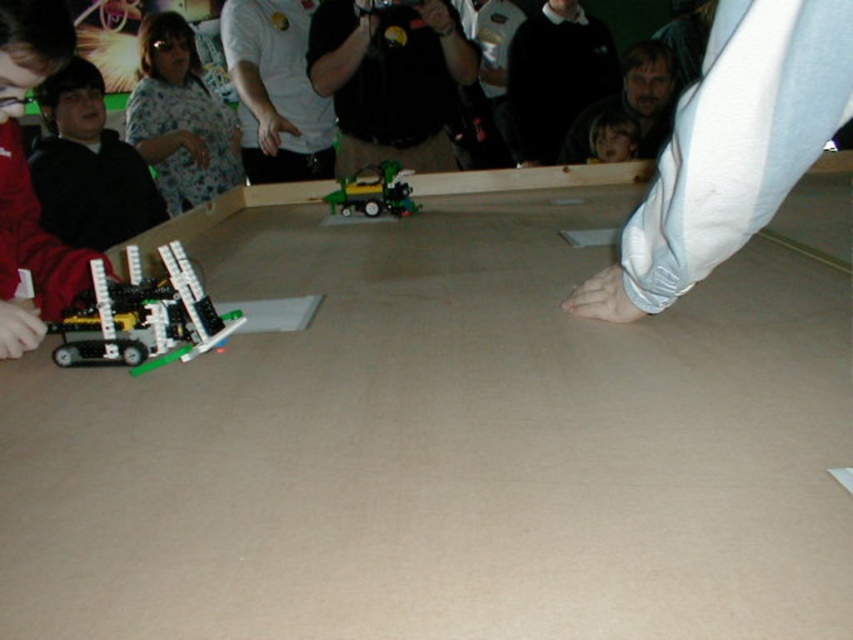
Question: Which object appears closest to the camera in this image?

Choices:
 (A) white matte shirt at upper center
 (B) translucent plastic robot at lower left

Answer: (B)

Question: Which of the following is the closest to the observer?

Choices:
 (A) (74, 273)
 (B) (357, 16)
 (C) (160, 154)
 (D) (590, 285)

Answer: (D)

Question: Does white matte shirt at upper center have a larger size compared to translucent plastic robot at lower left?

Choices:
 (A) no
 (B) yes

Answer: (B)

Question: Is floral shirt at upper left behind translucent plastic robot at lower left?

Choices:
 (A) yes
 (B) no

Answer: (A)

Question: Does black plastic camera at center appear on the right side of matte black robot at lower left?

Choices:
 (A) yes
 (B) no

Answer: (A)

Question: Which of these objects is positioned closest to the floral shirt at upper left?

Choices:
 (A) matte black robot at lower left
 (B) black plastic camera at center
 (C) translucent plastic robot at lower left

Answer: (B)